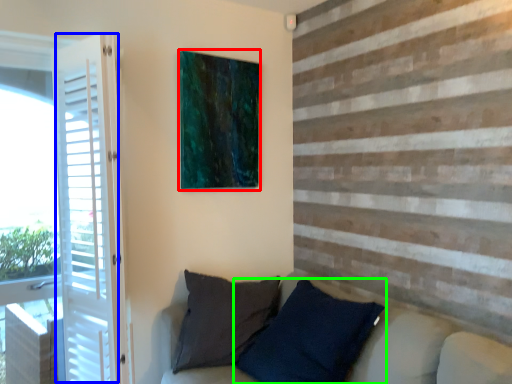
Question: Which is farther away from picture frame (highlighted by a red box)? screen door (highlighted by a blue box) or pillow (highlighted by a green box)?

Choices:
 (A) screen door
 (B) pillow

Answer: (B)